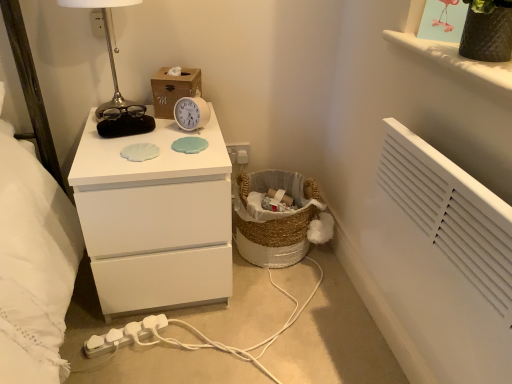
This screenshot has width=512, height=384. Identify the location of vacant area that lies between white matte chest of drawers at center and woven natural basket at lower center. (261, 289).